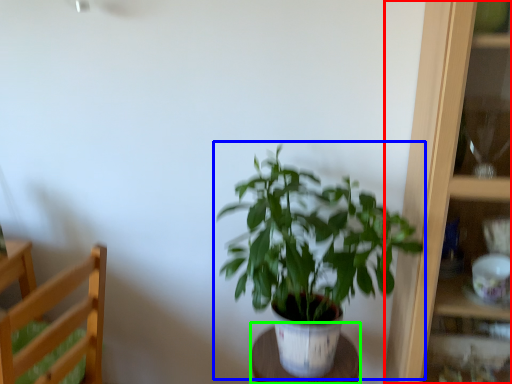
Question: Based on their relative distances, which object is farther from cabinet (highlighted by a red box)? Choose from houseplant (highlighted by a blue box) and table (highlighted by a green box).

Choices:
 (A) houseplant
 (B) table

Answer: (B)